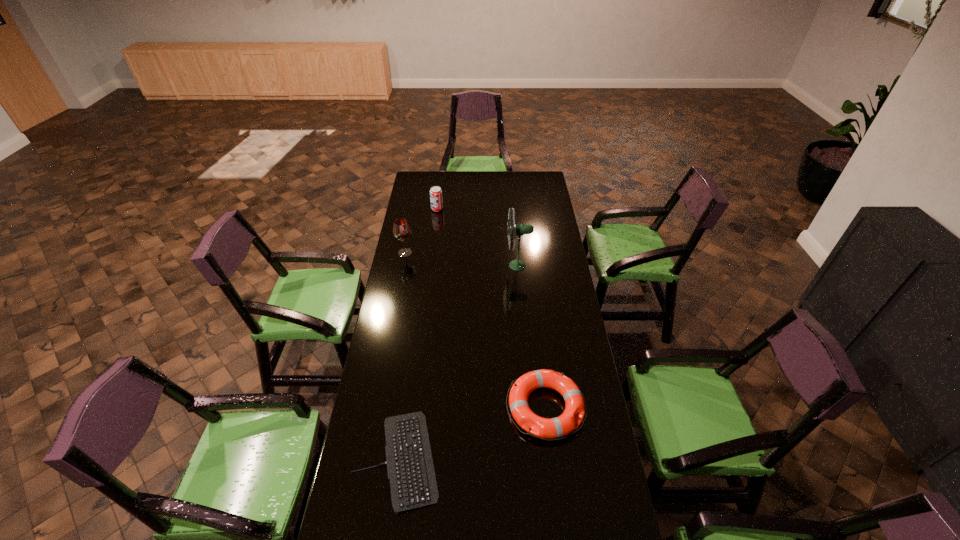
This screenshot has height=540, width=960. Find the location of `empty space between the computer keyboard and the tallest object`. empty space between the computer keyboard and the tallest object is located at coordinates (458, 362).

Identify the location of vacant point located between the life buoy and the fourth shortest object. This screenshot has height=540, width=960. (475, 330).

You are a GUI agent. You are given a task and a screenshot of the screen. Output one action in this format:
    pyautogui.click(x=<x>, y=<y>)
    Task: Click on the free space between the second shortest object and the farthest object
    Image resolution: width=960 pixels, height=540 pixels.
    Given the screenshot: What is the action you would take?
    pyautogui.click(x=492, y=308)

The height and width of the screenshot is (540, 960). I want to click on vacant area that lies between the farthest object and the fan, so click(x=477, y=237).

At what (x,y) coordinates should I click in order to perform the action: click on vacant area between the tallest object and the second shortest object. Please return your answer as a coordinate pair (x, y). The height and width of the screenshot is (540, 960). Looking at the image, I should click on (532, 336).

Image resolution: width=960 pixels, height=540 pixels. What are the coordinates of `vacant space that is in between the second shortest object and the fan` in the screenshot? It's located at (532, 336).

Where is `empty space that is in between the fourth tallest object and the wineglass`? empty space that is in between the fourth tallest object and the wineglass is located at coordinates (475, 330).

Find the location of `free space between the fan and the life buoy`. free space between the fan and the life buoy is located at coordinates (532, 336).

Where is `empty space that is in between the fourth tallest object and the tallest object`? The height and width of the screenshot is (540, 960). empty space that is in between the fourth tallest object and the tallest object is located at coordinates (532, 336).

Identify the location of vacant area that lies between the computer keyboard and the fourth shortest object. (401, 355).